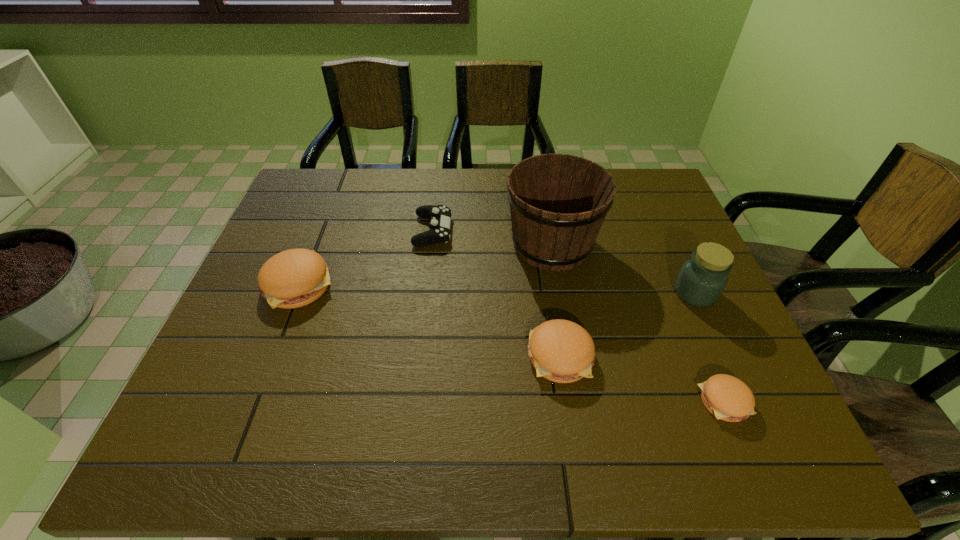
Locate an element on the screen. vacant spot for a new patty_(food) to ensure equal spacing is located at coordinates (420, 318).